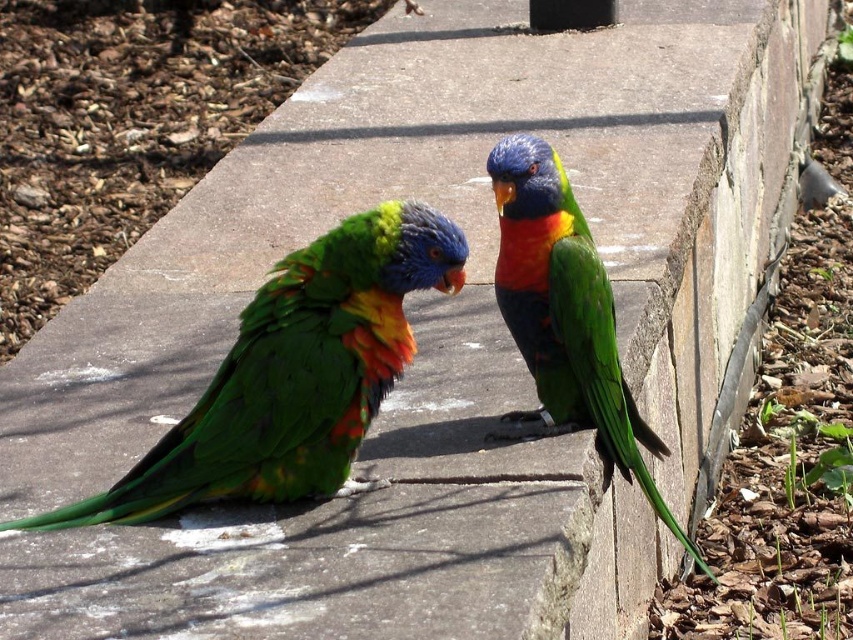
Question: Is multicolored feathered parrot at center above shiny multicolored parrot at center?

Choices:
 (A) no
 (B) yes

Answer: (A)

Question: Which of the following is the closest to the observer?

Choices:
 (A) shiny multicolored parrot at center
 (B) multicolored feathered parrot at center

Answer: (B)

Question: Can you confirm if multicolored feathered parrot at center is positioned to the right of shiny multicolored parrot at center?

Choices:
 (A) no
 (B) yes

Answer: (A)

Question: Which of the following is the closest to the observer?

Choices:
 (A) (548, 186)
 (B) (392, 269)

Answer: (B)

Question: Does multicolored feathered parrot at center come in front of shiny multicolored parrot at center?

Choices:
 (A) no
 (B) yes

Answer: (B)

Question: Which of the following is the closest to the observer?

Choices:
 (A) multicolored feathered parrot at center
 (B) shiny multicolored parrot at center

Answer: (A)